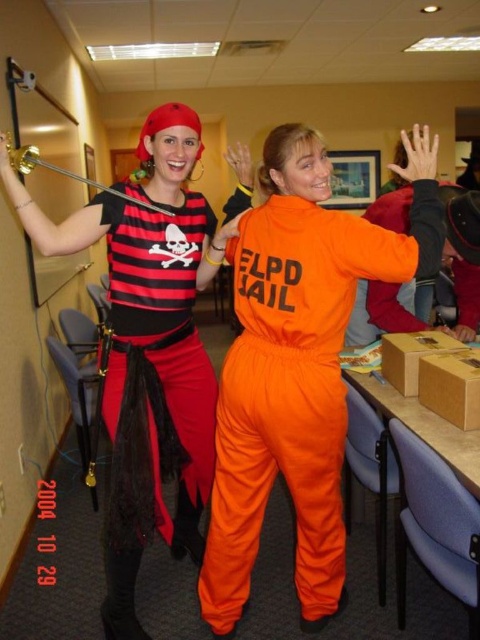
Between orange matte jumpsuit at center and matte black pirate vest at left, which one has more height?

orange matte jumpsuit at center

Which is behind, point (298, 518) or point (169, 444)?

The point (169, 444) is behind.

The image size is (480, 640). Find the location of `orange matte jumpsuit at center`. orange matte jumpsuit at center is located at coordinates (298, 365).

Can you confirm if matte black pirate costume at left is positioned to the left of matte black pirate vest at left?

Yes, matte black pirate costume at left is to the left of matte black pirate vest at left.

Consider the image. Which is more to the left, matte black pirate costume at left or matte black pirate vest at left?

matte black pirate costume at left

Where is `matte black pirate costume at left`? The image size is (480, 640). matte black pirate costume at left is located at coordinates (148, 346).

Can you confirm if orange matte jumpsuit at center is taller than matte black pirate costume at left?

In fact, orange matte jumpsuit at center may be shorter than matte black pirate costume at left.

Who is more distant from viewer, (304, 580) or (207, 385)?

The point (207, 385) is more distant.

Find the location of a particular element. orange matte jumpsuit at center is located at coordinates (298, 365).